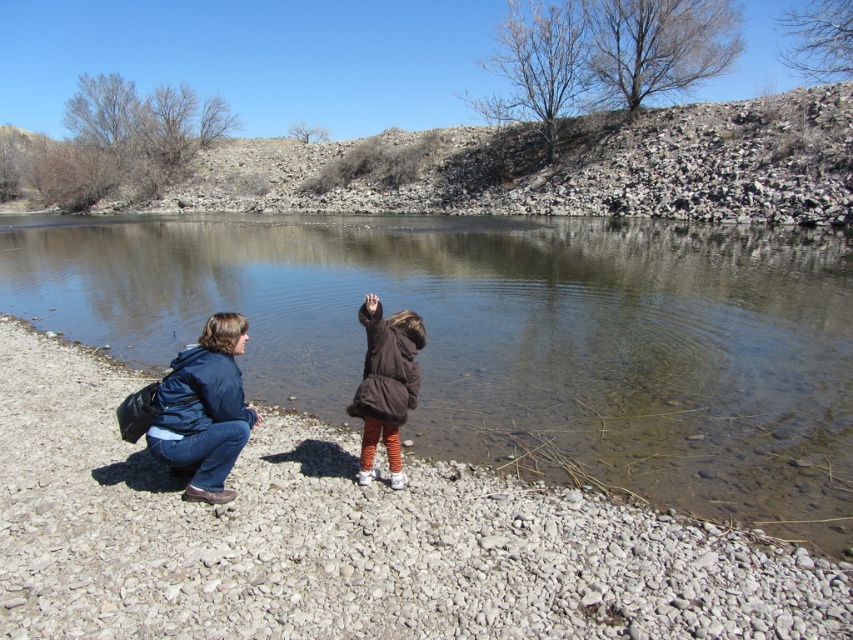
Who is higher up, gray gravel shore at lower left or denim jacket at lower left?

denim jacket at lower left is higher up.

Between point (79, 477) and point (219, 432), which one is positioned in front?

Point (219, 432)

Is point (285, 440) positioned before point (160, 456)?

No, (285, 440) is further to viewer.

This screenshot has height=640, width=853. Find the location of `gray gravel shore at lower left`. gray gravel shore at lower left is located at coordinates (347, 540).

The image size is (853, 640). What are the coordinates of `denim jacket at lower left` in the screenshot? It's located at (204, 410).

Can you confirm if denim jacket at lower left is positioned to the left of brown fuzzy coat at center?

Yes, denim jacket at lower left is to the left of brown fuzzy coat at center.

The width and height of the screenshot is (853, 640). I want to click on denim jacket at lower left, so click(x=204, y=410).

Who is higher up, gray gravel shore at lower left or brown fuzzy coat at center?

brown fuzzy coat at center is above.

Which is behind, point (78, 493) or point (401, 480)?

The point (401, 480) is behind.

Where is `gray gravel shore at lower left`? This screenshot has height=640, width=853. gray gravel shore at lower left is located at coordinates (347, 540).